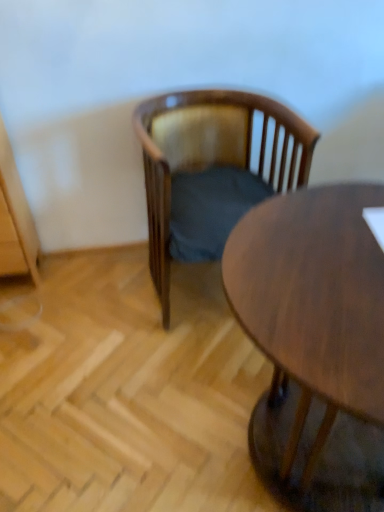
Question: Is wooden chair with cushion at center smaller than wooden round table at center?

Choices:
 (A) no
 (B) yes

Answer: (B)

Question: Considering the relative sizes of wooden chair with cushion at center and wooden round table at center in the image provided, is wooden chair with cushion at center thinner than wooden round table at center?

Choices:
 (A) no
 (B) yes

Answer: (B)

Question: Could wooden round table at center be considered to be inside wooden chair with cushion at center?

Choices:
 (A) no
 (B) yes

Answer: (A)

Question: Does wooden chair with cushion at center appear on the right side of wooden round table at center?

Choices:
 (A) no
 (B) yes

Answer: (A)

Question: Does wooden chair with cushion at center come in front of wooden round table at center?

Choices:
 (A) no
 (B) yes

Answer: (A)

Question: From a real-world perspective, is wooden chair with cushion at center on top of wooden round table at center?

Choices:
 (A) yes
 (B) no

Answer: (A)

Question: Considering the relative sizes of wooden round table at center and wooden chair with cushion at center in the image provided, is wooden round table at center smaller than wooden chair with cushion at center?

Choices:
 (A) no
 (B) yes

Answer: (A)

Question: Does wooden round table at center appear on the right side of wooden chair with cushion at center?

Choices:
 (A) no
 (B) yes

Answer: (B)

Question: Is wooden round table at center at the left side of wooden chair with cushion at center?

Choices:
 (A) yes
 (B) no

Answer: (B)

Question: Is wooden round table at center looking in the opposite direction of wooden chair with cushion at center?

Choices:
 (A) yes
 (B) no

Answer: (A)

Question: Can you confirm if wooden round table at center is thinner than wooden chair with cushion at center?

Choices:
 (A) yes
 (B) no

Answer: (B)

Question: Is wooden round table at center next to wooden chair with cushion at center and touching it?

Choices:
 (A) no
 (B) yes

Answer: (A)

Question: In terms of size, does wooden chair with cushion at center appear bigger or smaller than wooden round table at center?

Choices:
 (A) big
 (B) small

Answer: (B)